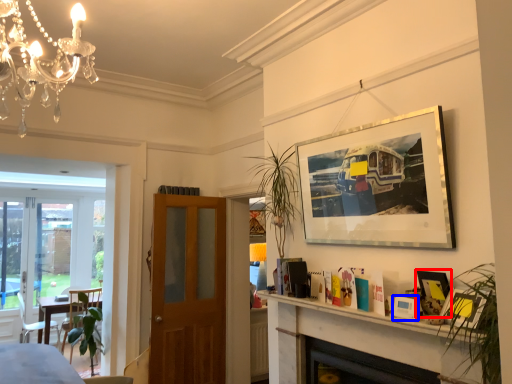
Question: Which of the following is the closest to the observer, picture frame (highlighted by a red box) or picture frame (highlighted by a blue box)?

Choices:
 (A) picture frame
 (B) picture frame

Answer: (B)